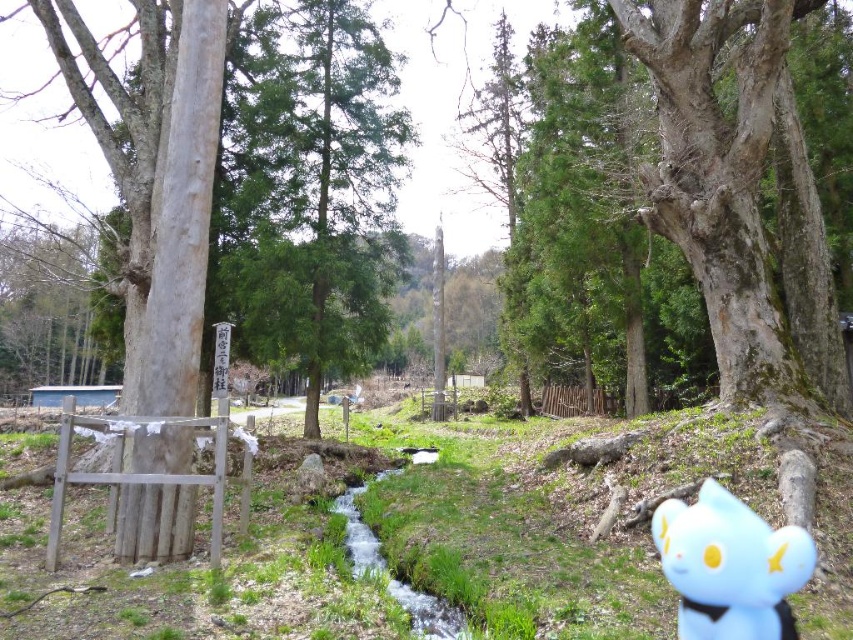
You are a hiker who has found a blue plush toy at lower right in a forest near a stream. If you want to place it exactly at the center of the stream, which flows from the bottom left to the center, how far in meters do you need to move it horizontally? The stream is 2 meters wide at its narrowest point.

The blue plush toy at lower right is currently at point (x=730, y=566). To place it at the center of the stream, you need to move it horizontally to the left by approximately 0.029 units. Since the stream is 2 meters wide, each unit corresponds to 2 meters, so the horizontal distance is about 0.058 meters.

From the picture: You are a hiker who found a blue plush toy at lower right and a clear water stream at center in a forest area. Which object is bigger in size?

The blue plush toy at lower right is larger in size than the clear water stream at center.